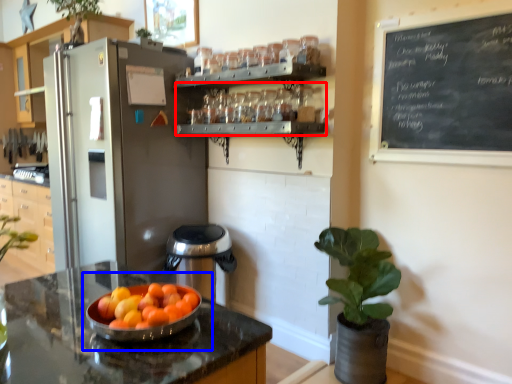
Question: Among these objects, which one is nearest to the camera, shelf (highlighted by a red box) or fruit dish (highlighted by a blue box)?

Choices:
 (A) shelf
 (B) fruit dish

Answer: (B)